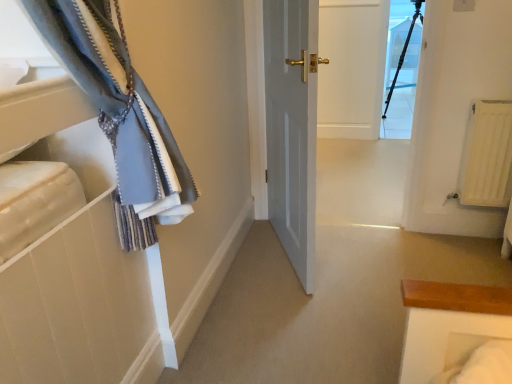
This screenshot has width=512, height=384. What do you see at coordinates (402, 74) in the screenshot?
I see `transparent glass tripod at upper center` at bounding box center [402, 74].

Locate an element on the screen. The image size is (512, 384). transparent glass tripod at upper center is located at coordinates (402, 74).

Measure the distance between point (496,120) and camera.

The distance of point (496,120) from camera is 1.89 meters.

What do you see at coordinates (487, 155) in the screenshot?
I see `white matte radiator at right` at bounding box center [487, 155].

The width and height of the screenshot is (512, 384). What are the coordinates of `white matte radiator at right` in the screenshot? It's located at pos(487,155).

What is the approximate height of white matte radiator at right?

white matte radiator at right is 20.35 inches tall.

In order to click on transparent glass tripod at upper center in this screenshot , I will do `click(402, 74)`.

Is transparent glass tripod at upper center at the left side of white matte radiator at right?

No.

Between transparent glass tripod at upper center and white matte radiator at right, which one is positioned behind?

transparent glass tripod at upper center is more distant.

Is point (401, 2) positioned after point (504, 194)?

Yes.

From the image's perspective, which object appears higher, transparent glass tripod at upper center or white matte radiator at right?

transparent glass tripod at upper center.

From a real-world perspective, is transparent glass tripod at upper center positioned under white matte radiator at right based on gravity?

No.

Does transparent glass tripod at upper center have a lesser width compared to white matte radiator at right?

Yes.

Can you confirm if transparent glass tripod at upper center is taller than white matte radiator at right?

Yes, transparent glass tripod at upper center is taller than white matte radiator at right.

Which of these two, transparent glass tripod at upper center or white matte radiator at right, is bigger?

white matte radiator at right.

Looking at this image, is transparent glass tripod at upper center spatially inside white matte radiator at right, or outside of it?

transparent glass tripod at upper center is spatially situated outside white matte radiator at right.

Is the surface of transparent glass tripod at upper center in direct contact with white matte radiator at right?

No, transparent glass tripod at upper center is not with white matte radiator at right.

Is white matte radiator at right at the back of transparent glass tripod at upper center?

transparent glass tripod at upper center does not have its back to white matte radiator at right.

How much distance is there between transparent glass tripod at upper center and white matte radiator at right?

transparent glass tripod at upper center is 2.50 meters from white matte radiator at right.

Find the location of `glass door on the right of white matte radiator at right`. glass door on the right of white matte radiator at right is located at coordinates (402, 74).

Would you say white matte radiator at right is to the left or to the right of transparent glass tripod at upper center in the picture?

Based on their positions, white matte radiator at right is located to the left of transparent glass tripod at upper center.

Which object is closer to the camera taking this photo, white matte radiator at right or transparent glass tripod at upper center?

white matte radiator at right.

Which point is more distant from viewer, (482, 110) or (414, 51)?

The point (414, 51) is farther.

From the image's perspective, is white matte radiator at right over transparent glass tripod at upper center?

No, from the image's perspective, white matte radiator at right is not on top of transparent glass tripod at upper center.

From a real-world perspective, is white matte radiator at right positioned under transparent glass tripod at upper center based on gravity?

Yes.

Which object is thinner, white matte radiator at right or transparent glass tripod at upper center?

Thinner between the two is transparent glass tripod at upper center.

Is white matte radiator at right taller or shorter than transparent glass tripod at upper center?

Considering their sizes, white matte radiator at right has less height than transparent glass tripod at upper center.

In the scene shown: Considering the sizes of objects white matte radiator at right and transparent glass tripod at upper center in the image provided, who is bigger, white matte radiator at right or transparent glass tripod at upper center?

Bigger between the two is white matte radiator at right.

Is transparent glass tripod at upper center surrounded by white matte radiator at right?

No.

From the picture: Are white matte radiator at right and transparent glass tripod at upper center far apart?

Yes.

Is white matte radiator at right facing away from transparent glass tripod at upper center?

Correct, white matte radiator at right is looking away from transparent glass tripod at upper center.

How different are the orientations of white matte radiator at right and transparent glass tripod at upper center in degrees?

3.56 degrees.

How much distance is there between white matte radiator at right and transparent glass tripod at upper center?

The distance of white matte radiator at right from transparent glass tripod at upper center is 2.50 meters.

At what (x,y) coordinates should I click in order to perform the action: click on radiator located underneath the transparent glass tripod at upper center (from a real-world perspective). Please return your answer as a coordinate pair (x, y). The image size is (512, 384). Looking at the image, I should click on (487, 155).

Locate an element on the screen. radiator in front of the transparent glass tripod at upper center is located at coordinates (487, 155).

Where is `glass door behind the white matte radiator at right`? glass door behind the white matte radiator at right is located at coordinates 402,74.